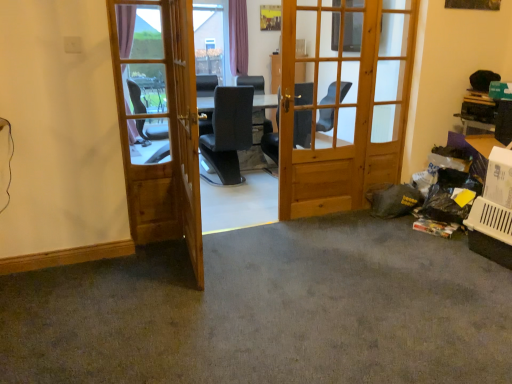
What do you see at coordinates (345, 101) in the screenshot?
I see `wooden door at center, which ranks as the 1th door in right-to-left order` at bounding box center [345, 101].

At what (x,y) coordinates should I click in order to perform the action: click on wooden door at center, the second door when ordered from left to right. Please return your answer as a coordinate pair (x, y). The image size is (512, 384). Looking at the image, I should click on (345, 101).

Considering the relative positions of gray carpet at lower right and light brown wooden screen door at center in the image provided, is gray carpet at lower right in front of light brown wooden screen door at center?

Yes, gray carpet at lower right is closer to the camera.

Considering the sizes of objects gray carpet at lower right and light brown wooden screen door at center in the image provided, who is taller, gray carpet at lower right or light brown wooden screen door at center?

With more height is light brown wooden screen door at center.

Is gray carpet at lower right wider than light brown wooden screen door at center?

Yes, gray carpet at lower right is wider than light brown wooden screen door at center.

Considering the relative sizes of gray carpet at lower right and light brown wooden screen door at center in the image provided, is gray carpet at lower right bigger than light brown wooden screen door at center?

Yes.

Which object is positioned more to the right, wooden door at center, which ranks as the 1th door in right-to-left order, or light brown wooden screen door at center?

Positioned to the right is wooden door at center, which ranks as the 1th door in right-to-left order.

From the picture: Which is closer to the camera, (307, 57) or (189, 233)?

The point (189, 233) is in front.

From the image's perspective, is wooden door at center, the second door when ordered from left to right, under light brown wooden screen door at center?

No.

From the image's perspective, does light brown wooden screen door at center appear lower than gray carpet at lower right?

Incorrect, from the image's perspective, light brown wooden screen door at center is higher than gray carpet at lower right.

Considering the sizes of objects light brown wooden screen door at center and gray carpet at lower right in the image provided, who is taller, light brown wooden screen door at center or gray carpet at lower right?

With more height is light brown wooden screen door at center.

From a real-world perspective, who is located higher, light brown wooden screen door at center or gray carpet at lower right?

light brown wooden screen door at center.

Is light brown wooden screen door at center closer to camera compared to gray carpet at lower right?

No, it is not.

In the scene shown: From the image's perspective, is wooden door at center, the second door when ordered from left to right, located above or below wooden door at left, placed as the 1th door when sorted from left to right?

wooden door at center, the second door when ordered from left to right, is situated higher than wooden door at left, placed as the 1th door when sorted from left to right, in the image.

Which object is more forward, wooden door at center, the second door when ordered from left to right, or wooden door at left, the second door positioned from the right?

Positioned in front is wooden door at left, the second door positioned from the right.

Which object is positioned more to the right, wooden door at center, which ranks as the 1th door in right-to-left order, or wooden door at left, placed as the 1th door when sorted from left to right?

From the viewer's perspective, wooden door at center, which ranks as the 1th door in right-to-left order, appears more on the right side.

From a real-world perspective, between wooden door at center, which ranks as the 1th door in right-to-left order, and wooden door at left, placed as the 1th door when sorted from left to right, who is vertically lower?

From a 3D spatial view, wooden door at left, placed as the 1th door when sorted from left to right, is below.

Is gray carpet at lower right in contact with wooden door at left, the second door positioned from the right?

gray carpet at lower right and wooden door at left, the second door positioned from the right, are not in contact.

Is gray carpet at lower right at the right side of wooden door at left, the second door positioned from the right?

Yes.

From the image's perspective, is gray carpet at lower right above wooden door at left, the second door positioned from the right?

No, from the image's perspective, gray carpet at lower right is not on top of wooden door at left, the second door positioned from the right.

Is gray carpet at lower right facing towards wooden door at left, the second door positioned from the right?

No, gray carpet at lower right is not oriented towards wooden door at left, the second door positioned from the right.

Considering the sizes of gray carpet at lower right and wooden door at center, which ranks as the 1th door in right-to-left order, in the image, is gray carpet at lower right wider or thinner than wooden door at center, which ranks as the 1th door in right-to-left order,?

Considering their sizes, gray carpet at lower right looks broader than wooden door at center, which ranks as the 1th door in right-to-left order.

From a real-world perspective, who is located higher, gray carpet at lower right or wooden door at center, the second door when ordered from left to right?

From a 3D spatial view, wooden door at center, the second door when ordered from left to right, is above.

Who is taller, gray carpet at lower right or wooden door at center, which ranks as the 1th door in right-to-left order?

Standing taller between the two is wooden door at center, which ranks as the 1th door in right-to-left order.

Does gray carpet at lower right touch wooden door at center, the second door when ordered from left to right?

No, gray carpet at lower right is not in contact with wooden door at center, the second door when ordered from left to right.

From the picture: From a real-world perspective, does wooden door at center, which ranks as the 1th door in right-to-left order, sit lower than gray carpet at lower right?

Incorrect, from a real-world perspective, wooden door at center, which ranks as the 1th door in right-to-left order, is higher than gray carpet at lower right.

From the image's perspective, is wooden door at center, which ranks as the 1th door in right-to-left order, on gray carpet at lower right?

Yes.

Which is behind, point (304, 150) or point (387, 245)?

Positioned behind is point (304, 150).

Identify the location of screen door on the left of gray carpet at lower right. Image resolution: width=512 pixels, height=384 pixels. (187, 130).

From the light brown wooden screen door at center, count 2nd doors backward and point to it. Please provide its 2D coordinates.

[(345, 101)]

Considering their positions, is gray carpet at lower right positioned closer to wooden door at left, the second door positioned from the right, than wooden door at center, which ranks as the 1th door in right-to-left order?

Among the two, gray carpet at lower right is located nearer to wooden door at left, the second door positioned from the right.

From the image, which object appears to be nearer to light brown wooden screen door at center, gray carpet at lower right or wooden door at center, which ranks as the 1th door in right-to-left order?

gray carpet at lower right is positioned closer to the anchor light brown wooden screen door at center.

Which object lies nearer to the anchor point gray carpet at lower right, wooden door at left, the second door positioned from the right, or wooden door at center, which ranks as the 1th door in right-to-left order?

Based on the image, wooden door at left, the second door positioned from the right, appears to be nearer to gray carpet at lower right.

Estimate the real-world distances between objects in this image. Which object is further from light brown wooden screen door at center, wooden door at center, the second door when ordered from left to right, or gray carpet at lower right?

The object further to light brown wooden screen door at center is wooden door at center, the second door when ordered from left to right.

Looking at the image, which one is located further to light brown wooden screen door at center, gray carpet at lower right or wooden door at left, placed as the 1th door when sorted from left to right?

gray carpet at lower right is further to light brown wooden screen door at center.

Which object lies further to the anchor point wooden door at center, which ranks as the 1th door in right-to-left order, light brown wooden screen door at center or wooden door at left, placed as the 1th door when sorted from left to right?

The object further to wooden door at center, which ranks as the 1th door in right-to-left order, is light brown wooden screen door at center.

Considering their positions, is wooden door at left, placed as the 1th door when sorted from left to right, positioned further to wooden door at center, which ranks as the 1th door in right-to-left order, than gray carpet at lower right?

gray carpet at lower right is positioned further to the anchor wooden door at center, which ranks as the 1th door in right-to-left order.

Considering their positions, is light brown wooden screen door at center positioned closer to wooden door at center, which ranks as the 1th door in right-to-left order, than gray carpet at lower right?

Based on the image, light brown wooden screen door at center appears to be nearer to wooden door at center, which ranks as the 1th door in right-to-left order.

This screenshot has width=512, height=384. I want to click on screen door between gray carpet at lower right and wooden door at center, which ranks as the 1th door in right-to-left order, along the z-axis, so click(187, 130).

Find the location of a particular element. This screenshot has height=384, width=512. screen door between gray carpet at lower right and wooden door at left, placed as the 1th door when sorted from left to right, along the z-axis is located at coordinates (187, 130).

Locate an element on the screen. The width and height of the screenshot is (512, 384). screen door between wooden door at left, placed as the 1th door when sorted from left to right, and wooden door at center, which ranks as the 1th door in right-to-left order, in the horizontal direction is located at coordinates (187, 130).

Image resolution: width=512 pixels, height=384 pixels. I want to click on door located between gray carpet at lower right and wooden door at center, the second door when ordered from left to right, in the depth direction, so click(x=159, y=121).